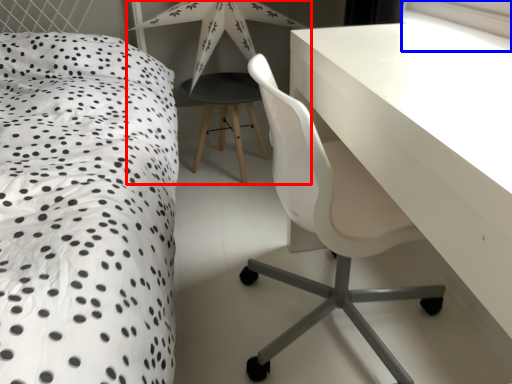
Question: Which object appears closest to the camera in this image, table lamp (highlighted by a red box) or window screen (highlighted by a blue box)?

Choices:
 (A) table lamp
 (B) window screen

Answer: (B)